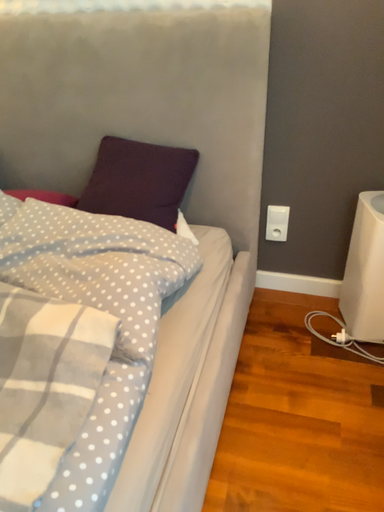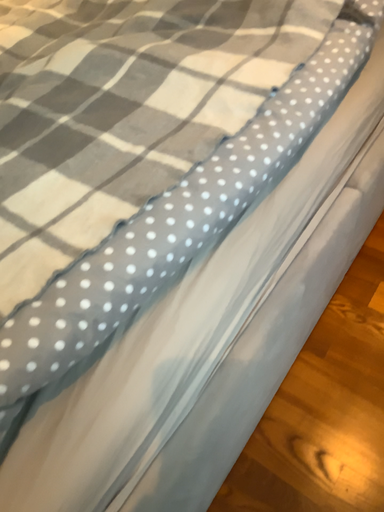
Question: Which way did the camera rotate in the video?

Choices:
 (A) rotated left
 (B) rotated right

Answer: (A)